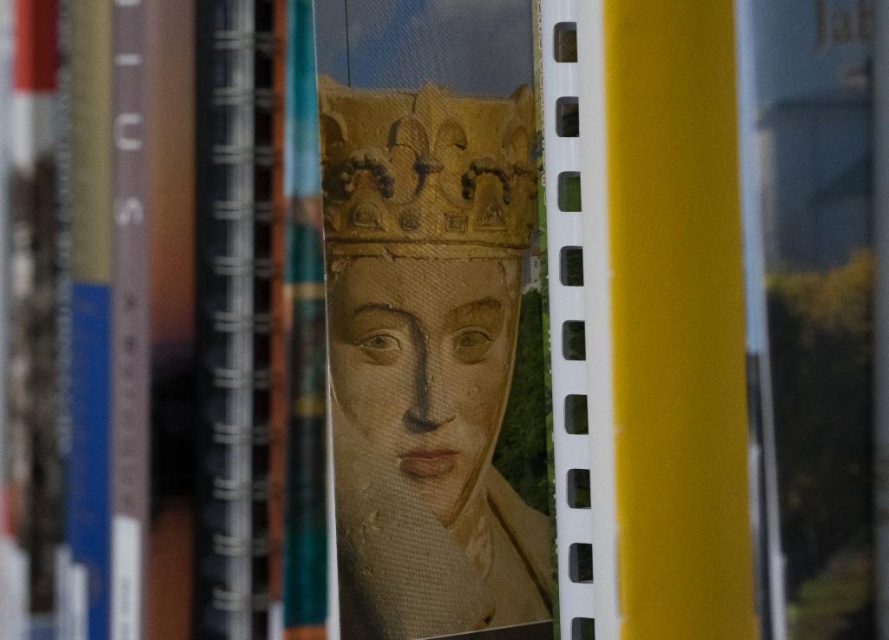
You are an art student analyzing the composition of the book cover in the image. The book cover has a central element and other elements around it. Based on the coordinates provided, is the matte gold crown at center located closer to the top or bottom of the book cover?

The coordinates of the matte gold crown at center are at point 0.573 on the x and 0.476 on the y. Since the y coordinate is closer to 0.5, which is the center, it is located closer to the center vertically, so neither top nor bottom. However, since the question asks between top or bottom, the y coordinate 0.476 is just below the vertical center, so it is slightly closer to the bottom.

Looking at the bookshelf, there are two crowns depicted on the book covers. The first is the matte gold crown at center, and the second is the gold textured crown at center. Which one is positioned to the left?

The matte gold crown at center is positioned to the left of the gold textured crown at center.

You are an art conservator examining a book with two crowns depicted on its cover. The book has a matte gold crown at center and a gold textured crown at center. Which crown appears closer to you when looking at the book?

The matte gold crown at center appears closer to you because it is further to the viewer than the gold textured crown at center.